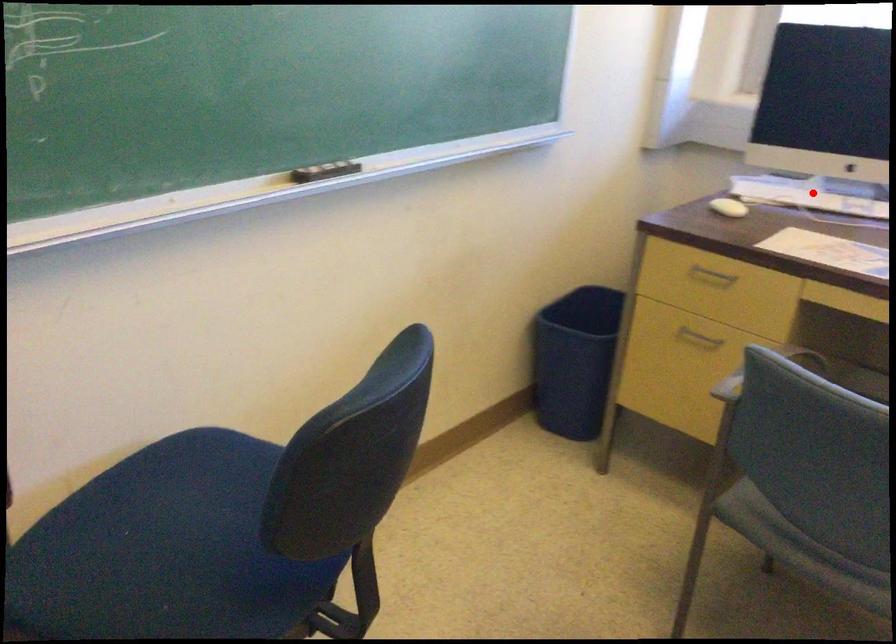
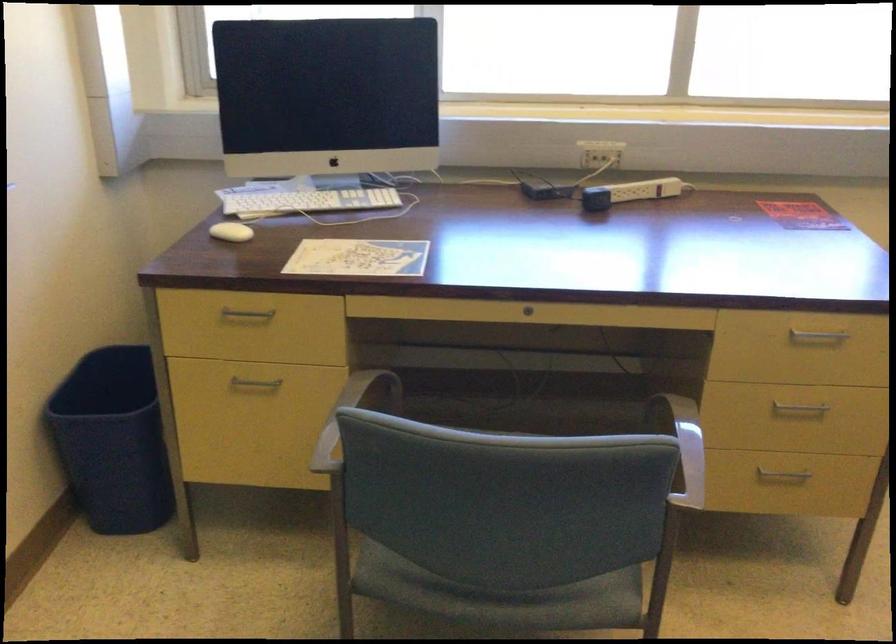
The point at the highlighted location is marked in the first image. Where is the corresponding point in the second image?

(304, 200)